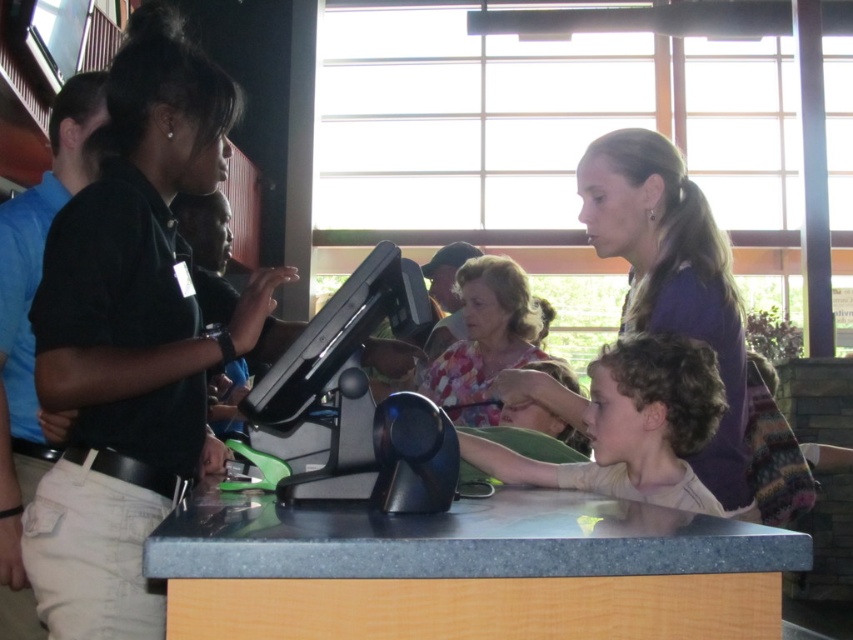
You are a delivery person trying to place a package on the granite countertop at center. The package is 3 feet wide. Can you fit it on the countertop without overlapping the purple matte shirt at upper right?

The granite countertop at center and purple matte shirt at upper right are 3.43 feet apart. Since the package is 3 feet wide, it can fit between them without overlapping.

You are a customer at the counter and need to hand your order to the person in the purple matte shirt at upper right. Which direction should you move relative to the granite countertop at center?

The granite countertop at center is to the left of the purple matte shirt at upper right, so you should move to the right relative to the granite countertop at center to reach the purple matte shirt at upper right.